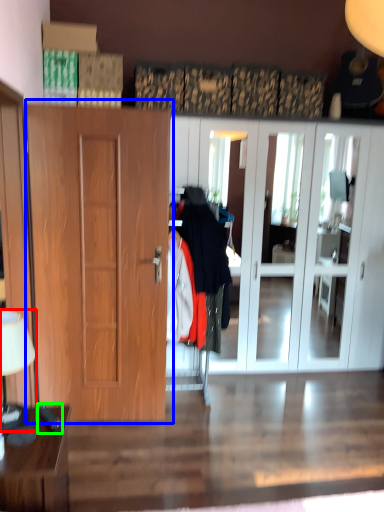
Question: Considering the real-world distances, which object is closest to lamp (highlighted by a red box)? door (highlighted by a blue box) or remote control (highlighted by a green box).

Choices:
 (A) door
 (B) remote control

Answer: (B)